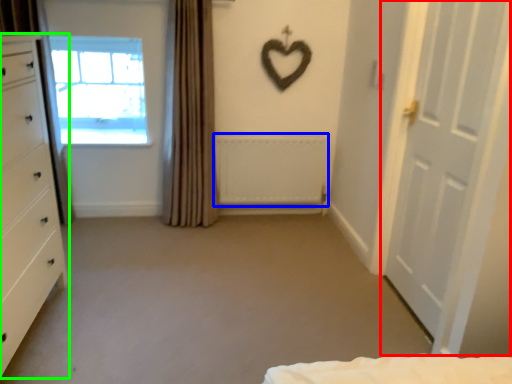
Question: Considering the real-world distances, which object is closest to door (highlighted by a red box)? radiator (highlighted by a blue box) or chest of drawers (highlighted by a green box).

Choices:
 (A) radiator
 (B) chest of drawers

Answer: (A)